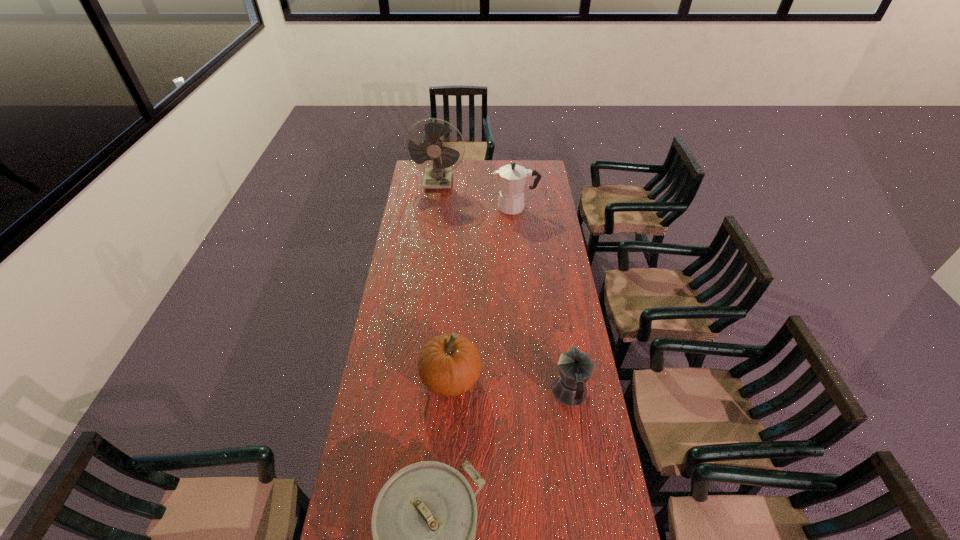
At what (x,y) coordinates should I click in order to perform the action: click on the farthest object. Please return your answer as a coordinate pair (x, y). The image size is (960, 540). Looking at the image, I should click on (439, 175).

Locate an element on the screen. the tallest object is located at coordinates (439, 175).

You are a GUI agent. You are given a task and a screenshot of the screen. Output one action in this format:
    pyautogui.click(x=<x>, y=<y>)
    Task: Click on the farther coffeepot
    This screenshot has height=540, width=960.
    Given the screenshot: What is the action you would take?
    pyautogui.click(x=512, y=177)

The image size is (960, 540). I want to click on the taller coffeepot, so click(x=512, y=177).

Where is `pumpkin`? The image size is (960, 540). pumpkin is located at coordinates (449, 365).

Find the location of a particular element. This screenshot has height=540, width=960. the nearer coffeepot is located at coordinates (575, 368).

I want to click on vacant area located 0.120m on the front-facing side of the farthest object, so click(x=436, y=202).

Where is `vacant space situated 0.340m at the spout of the taller coffeepot`? The width and height of the screenshot is (960, 540). vacant space situated 0.340m at the spout of the taller coffeepot is located at coordinates (433, 207).

I want to click on free space located 0.250m at the spout of the taller coffeepot, so 449,207.

This screenshot has width=960, height=540. I want to click on free spot located 0.310m at the spout of the taller coffeepot, so click(439, 207).